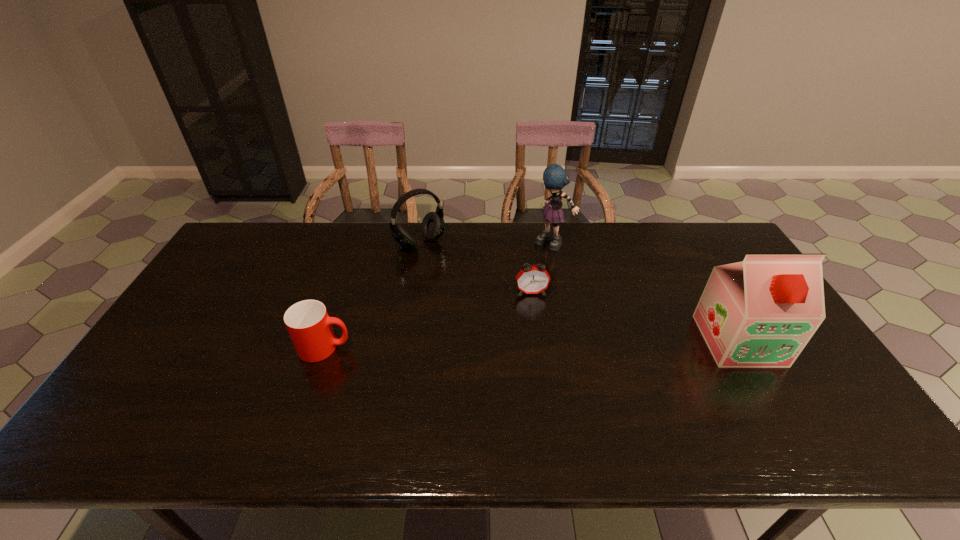
What are the coordinates of `free spot at the far edge of the desktop` in the screenshot? It's located at click(654, 255).

The height and width of the screenshot is (540, 960). Find the location of `vacant space at the near edge of the desktop`. vacant space at the near edge of the desktop is located at coordinates (397, 408).

At what (x,y) coordinates should I click in order to perform the action: click on vacant space at the far left corner of the desktop. Please return your answer as a coordinate pair (x, y). Looking at the image, I should click on (229, 251).

Where is `blank space at the far right corner`? This screenshot has height=540, width=960. blank space at the far right corner is located at coordinates click(690, 225).

In the image, there is a desktop. Where is `free region at the near right corner`? Image resolution: width=960 pixels, height=540 pixels. free region at the near right corner is located at coordinates (786, 403).

This screenshot has height=540, width=960. In order to click on unoccupied area between the second object from left to right and the rightmost object in this screenshot , I will do `click(579, 292)`.

Identify the location of free space between the leftmost object and the rag doll. This screenshot has width=960, height=540. (439, 296).

Locate an element on the screen. empty space that is in between the rag doll and the headset is located at coordinates point(486,244).

Find the location of a particular element. This screenshot has height=540, width=960. empty space between the soya milk and the second object from left to right is located at coordinates (579, 292).

The width and height of the screenshot is (960, 540). I want to click on free point between the third farthest object and the third tallest object, so click(475, 267).